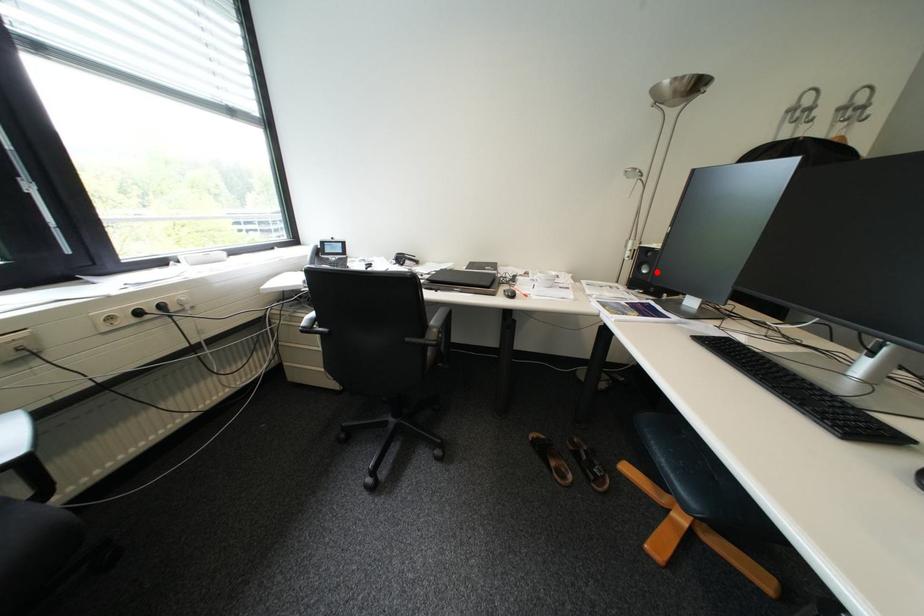
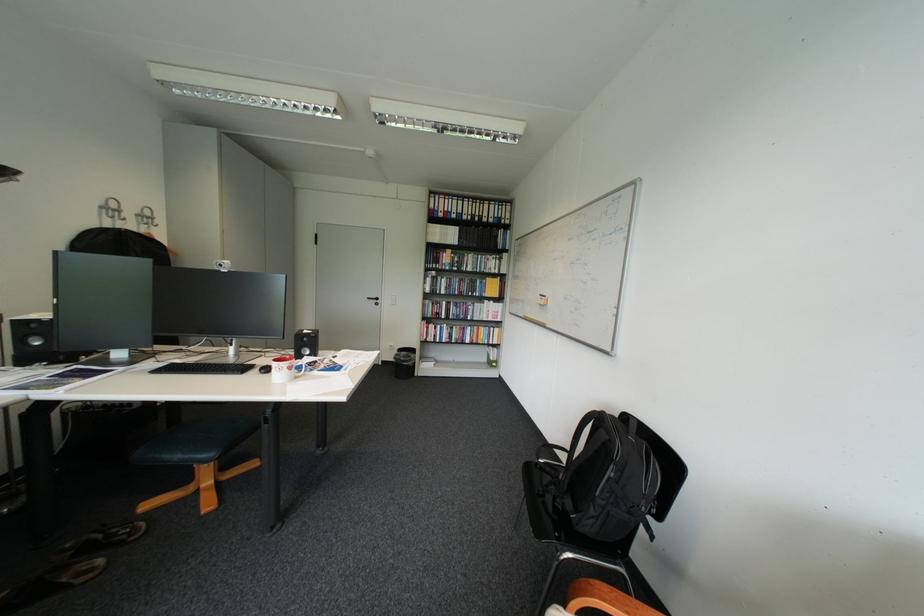
In the second image, find the point that corresponds to the highlighted location in the first image.

(51, 344)